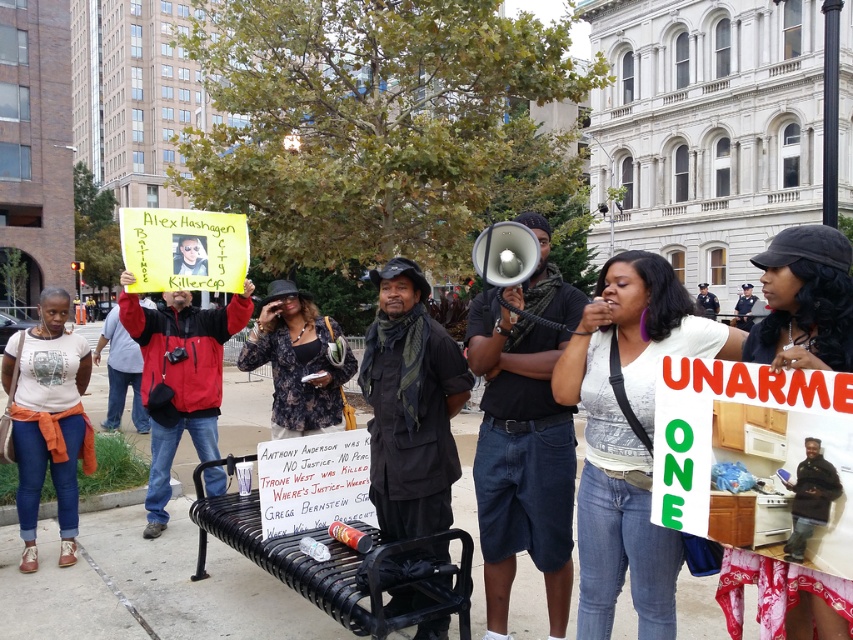
You are a photographer trying to capture a clear shot of both the black fabric hat at upper center and the black metal bench at center. Based on their positions, can you fit both into your camera frame without moving your position?

The black fabric hat at upper center is located above the black metal bench at center, so yes, you can fit both into your camera frame by adjusting the angle or zoom to include both the hat above and the bench below.

As an observer standing at the center of the protest scene, you notice two points marked in the image. Which point, point (666, 323) or point (309, 433), is closer to you?

Point (666, 323) is in front of point (309, 433), so it is closer to the observer.